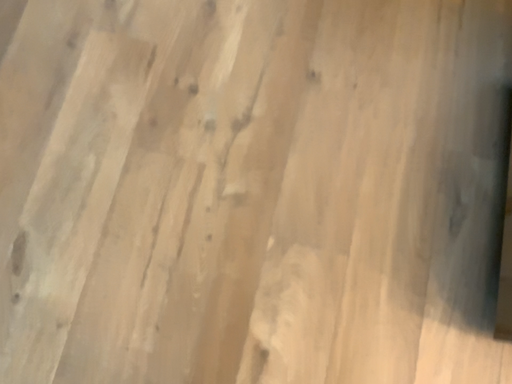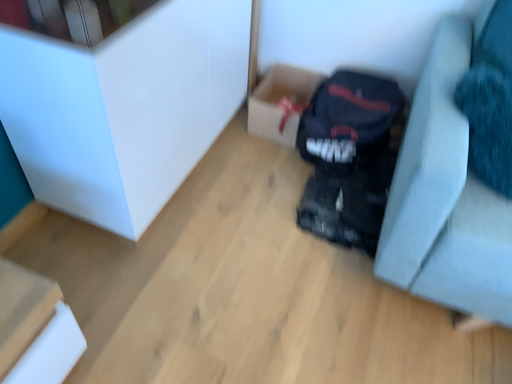
Question: How did the camera likely rotate when shooting the video?

Choices:
 (A) rotated upward
 (B) rotated downward

Answer: (A)